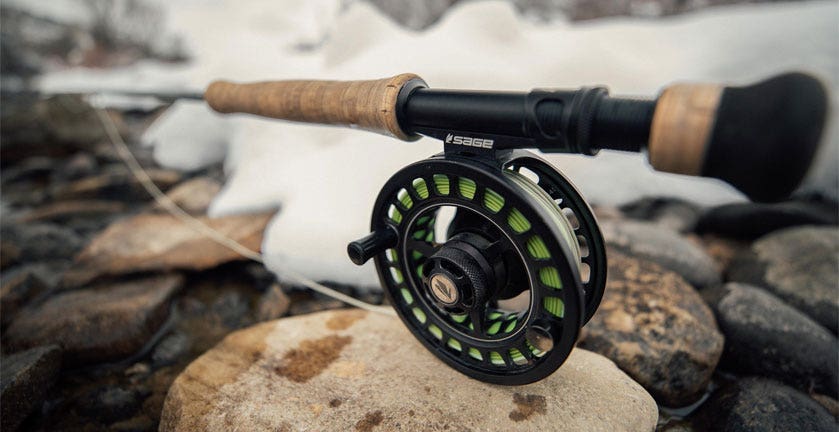
This screenshot has height=432, width=839. What are the coordinates of `handles` in the screenshot? It's located at (790, 133), (362, 244).